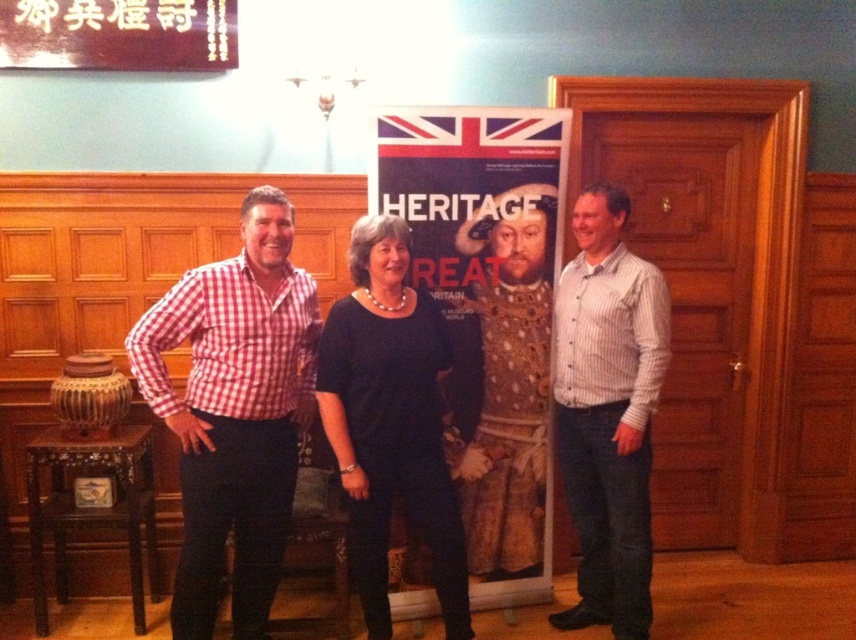
Question: Is red checkered shirt at left bigger than black jersey at center?

Choices:
 (A) yes
 (B) no

Answer: (A)

Question: Which of the following is the closest to the observer?

Choices:
 (A) white striped shirt at right
 (B) dark wood stool at lower left
 (C) matte paper poster at center

Answer: (A)

Question: Is the position of matte paper poster at center less distant than that of dark wood stool at lower left?

Choices:
 (A) no
 (B) yes

Answer: (B)

Question: Which of the following is the farthest from the observer?

Choices:
 (A) (479, 237)
 (B) (635, 390)

Answer: (A)

Question: Estimate the real-world distances between objects in this image. Which object is farther from the white striped shirt at right?

Choices:
 (A) red checkered shirt at left
 (B) black jersey at center
 (C) dark wood stool at lower left
 (D) matte paper poster at center

Answer: (C)

Question: Can you confirm if matte paper poster at center is positioned to the right of red checkered shirt at left?

Choices:
 (A) yes
 (B) no

Answer: (A)